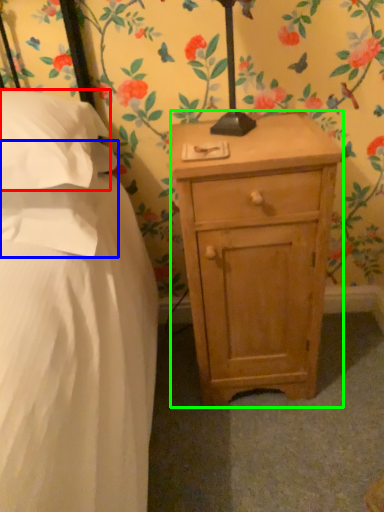
Question: Based on their relative distances, which object is farther from pillow (highlighted by a red box)? Choose from pillow (highlighted by a blue box) and nightstand (highlighted by a green box).

Choices:
 (A) pillow
 (B) nightstand

Answer: (B)